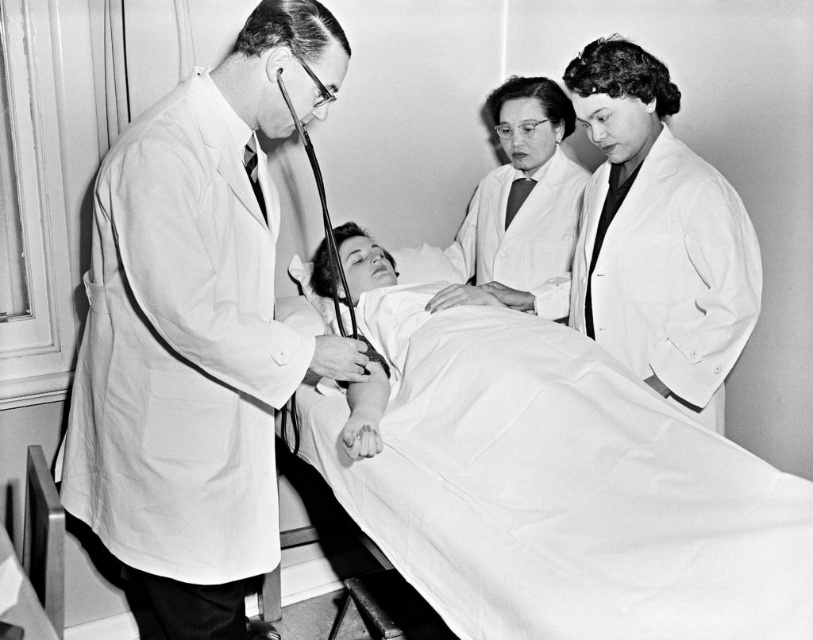
Question: Which object is closer to the camera taking this photo?

Choices:
 (A) metallic smooth stethoscope at center
 (B) white smooth bed at center
 (C) white smooth lab coat at right

Answer: (B)

Question: Which is farther from the white lab coat at center?

Choices:
 (A) white smooth bed at center
 (B) white smooth lab coat at right

Answer: (A)

Question: Can you confirm if white lab coat at center is positioned to the right of metallic smooth stethoscope at center?

Choices:
 (A) yes
 (B) no

Answer: (A)

Question: From the image, what is the correct spatial relationship of white smooth bed at center in relation to metallic smooth stethoscope at center?

Choices:
 (A) above
 (B) below

Answer: (B)

Question: Which is farther from the white smooth lab coat at right?

Choices:
 (A) metallic smooth stethoscope at center
 (B) white smooth bed at center
 (C) white lab coat at center

Answer: (A)

Question: Can you confirm if white lab coat at center is thinner than metallic smooth stethoscope at center?

Choices:
 (A) yes
 (B) no

Answer: (B)